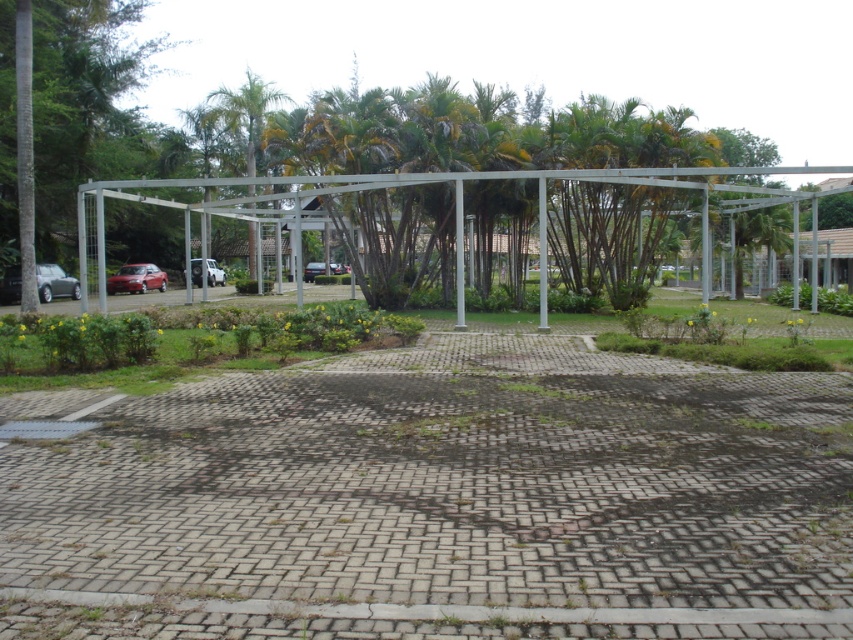
Question: Is the position of green leafy palm tree at upper center more distant than that of white matte car at center?

Choices:
 (A) yes
 (B) no

Answer: (A)

Question: From the image, what is the correct spatial relationship of green leafy tree at center in relation to white matte car at center?

Choices:
 (A) right
 (B) left

Answer: (A)

Question: Considering the real-world distances, which object is closest to the satin black car at center?

Choices:
 (A) satin silver car at lower left
 (B) white matte car at center
 (C) green leafy tree at center
 (D) shiny red sedan at lower left

Answer: (B)

Question: Among these objects, which one is nearest to the camera?

Choices:
 (A) satin silver car at lower left
 (B) shiny red sedan at lower left

Answer: (A)

Question: Estimate the real-world distances between objects in this image. Which object is farther from the green leafy tree at center?

Choices:
 (A) shiny red sedan at lower left
 (B) satin silver car at lower left
 (C) satin black car at center

Answer: (C)

Question: Where is green leafy tree at center located in relation to white matte car at center in the image?

Choices:
 (A) below
 (B) above

Answer: (B)